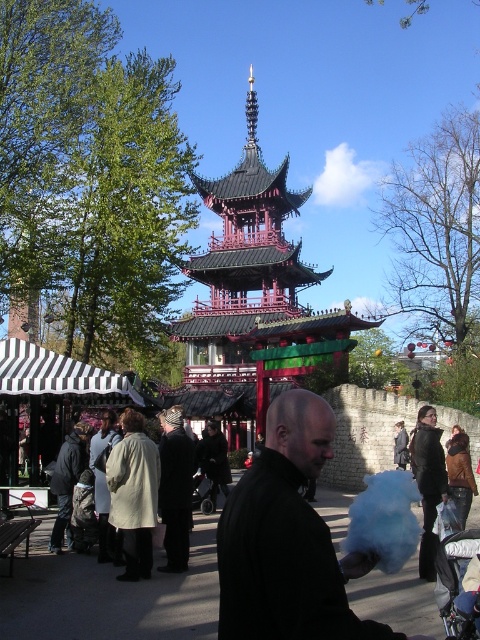
Question: Does reddish-pink wooden pagoda at center appear on the right side of dark gray jacket at center?

Choices:
 (A) yes
 (B) no

Answer: (A)

Question: Does reddish-pink wooden pagoda at center have a larger size compared to black matte cotton candy at center?

Choices:
 (A) yes
 (B) no

Answer: (A)

Question: Does reddish-pink wooden pagoda at center appear under black matte cotton candy at center?

Choices:
 (A) no
 (B) yes

Answer: (A)

Question: Which of these objects is positioned farthest from the dark gray jacket at center?

Choices:
 (A) black matte cotton candy at center
 (B) reddish-pink wooden pagoda at center

Answer: (B)

Question: Among these objects, which one is nearest to the camera?

Choices:
 (A) dark gray jacket at center
 (B) black matte cotton candy at center

Answer: (B)

Question: Which object appears farthest from the camera in this image?

Choices:
 (A) black matte cotton candy at center
 (B) reddish-pink wooden pagoda at center

Answer: (B)